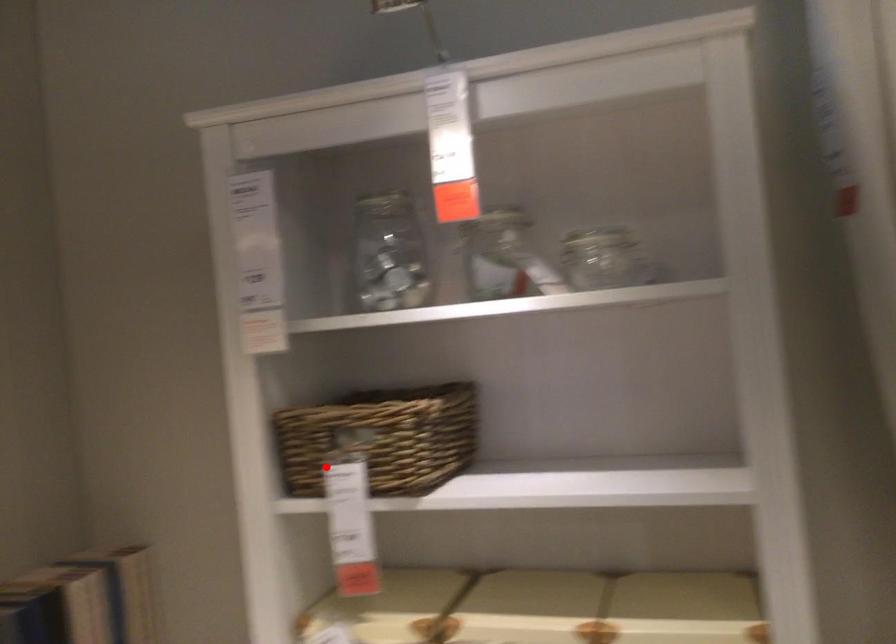
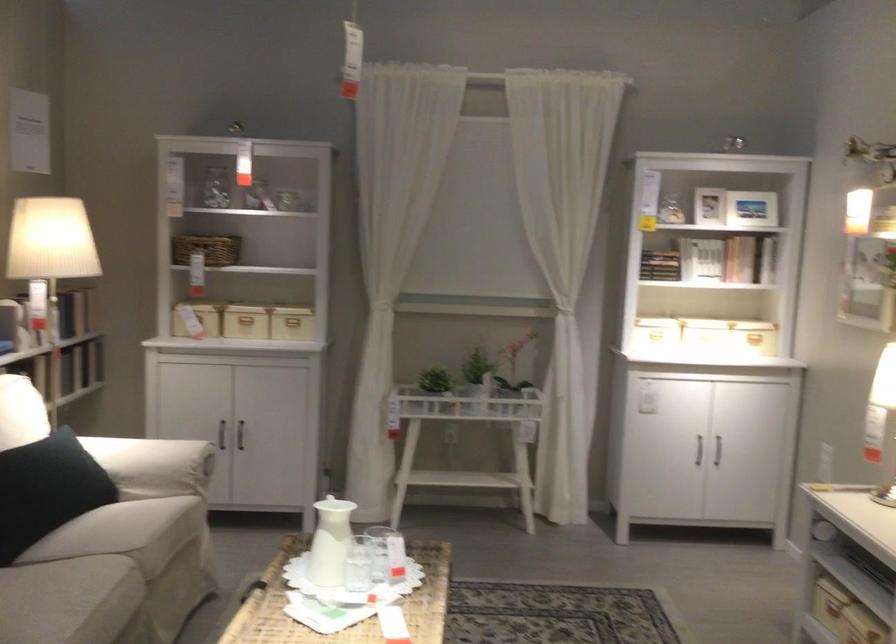
The point at the highlighted location is marked in the first image. Where is the corresponding point in the second image?

(207, 249)